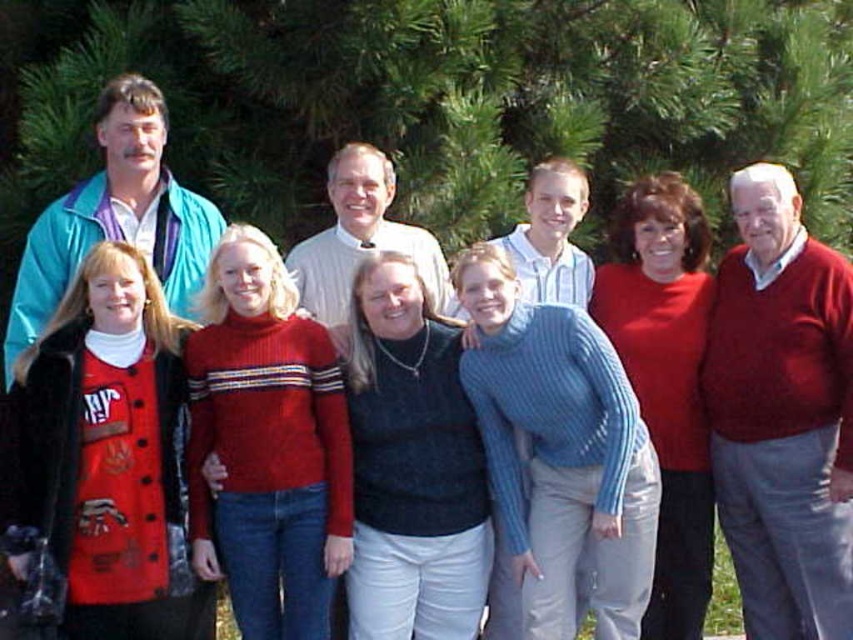
Question: Can you confirm if green leafy pine at upper center is thinner than red sweater at right?

Choices:
 (A) no
 (B) yes

Answer: (A)

Question: Among these objects, which one is farthest from the camera?

Choices:
 (A) red sweater at right
 (B) green leafy pine at upper center

Answer: (B)

Question: Among these objects, which one is nearest to the camera?

Choices:
 (A) red sweater at right
 (B) green leafy pine at upper center

Answer: (A)

Question: Does green leafy pine at upper center have a lesser width compared to red sweater at right?

Choices:
 (A) yes
 (B) no

Answer: (B)

Question: Which point is farther to the camera?

Choices:
 (A) green leafy pine at upper center
 (B) red sweater at right

Answer: (A)

Question: Is green leafy pine at upper center to the left of red sweater at right from the viewer's perspective?

Choices:
 (A) no
 (B) yes

Answer: (B)